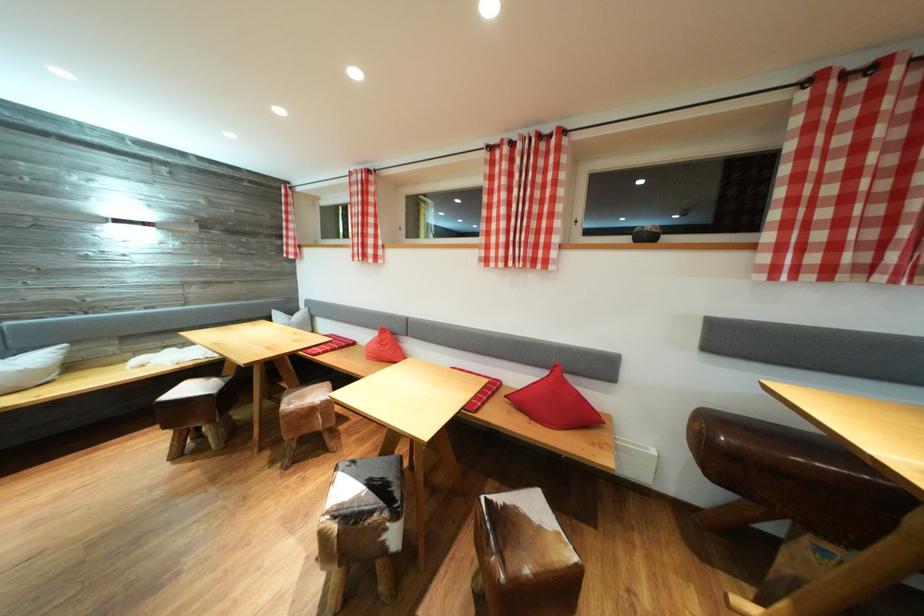
What do you see at coordinates (360, 524) in the screenshot? This screenshot has width=924, height=616. I see `the pommel horse seat` at bounding box center [360, 524].